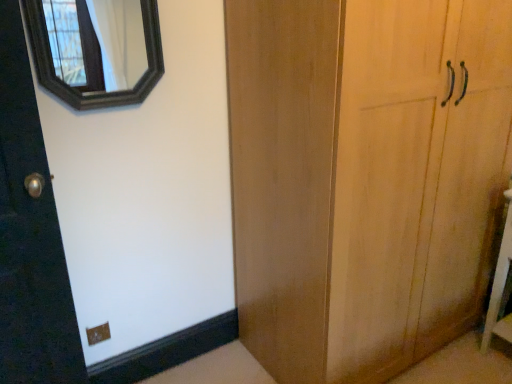
Question: Considering the positions of white wood vanity at lower right and black wooden mirror at upper left in the image, is white wood vanity at lower right wider or thinner than black wooden mirror at upper left?

Choices:
 (A) wide
 (B) thin

Answer: (A)

Question: Would you say white wood vanity at lower right is to the left or to the right of black wooden mirror at upper left in the picture?

Choices:
 (A) right
 (B) left

Answer: (A)

Question: Based on their sizes in the image, would you say white wood vanity at lower right is bigger or smaller than black wooden mirror at upper left?

Choices:
 (A) small
 (B) big

Answer: (B)

Question: Choose the correct answer: Is black wooden mirror at upper left inside white wood vanity at lower right or outside it?

Choices:
 (A) inside
 (B) outside

Answer: (B)

Question: In the image, is black wooden mirror at upper left positioned in front of or behind white wood vanity at lower right?

Choices:
 (A) behind
 (B) front

Answer: (B)

Question: Does point (79, 79) appear closer or farther from the camera than point (507, 226)?

Choices:
 (A) farther
 (B) closer

Answer: (A)

Question: From the image's perspective, relative to white wood vanity at lower right, is black wooden mirror at upper left above or below?

Choices:
 (A) above
 (B) below

Answer: (A)